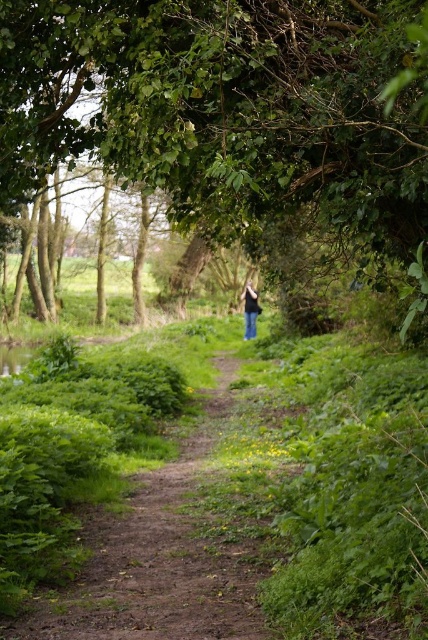
Is green leafy tree at center smaller than dirt path at center?

No, green leafy tree at center is not smaller than dirt path at center.

Can you confirm if green leafy tree at center is positioned to the left of dirt path at center?

Incorrect, green leafy tree at center is not on the left side of dirt path at center.

Does point (80, 84) come farther from viewer compared to point (181, 528)?

No, (80, 84) is in front of (181, 528).

Where is `green leafy tree at center`? Image resolution: width=428 pixels, height=640 pixels. green leafy tree at center is located at coordinates (226, 106).

Who is higher up, green leafy tree at center or denim jeans at center?

Answer: Positioned higher is green leafy tree at center.

Locate an element on the screen. The height and width of the screenshot is (640, 428). green leafy tree at center is located at coordinates (226, 106).

Where is `dirt path at center`? The height and width of the screenshot is (640, 428). dirt path at center is located at coordinates (163, 554).

How far apart are dirt path at center and denim jeans at center?

dirt path at center is 16.55 meters from denim jeans at center.

Which is behind, point (235, 577) or point (250, 285)?

The point (250, 285) is behind.

At what (x,y) coordinates should I click in order to perform the action: click on dirt path at center. Please return your answer as a coordinate pair (x, y). Looking at the image, I should click on (163, 554).